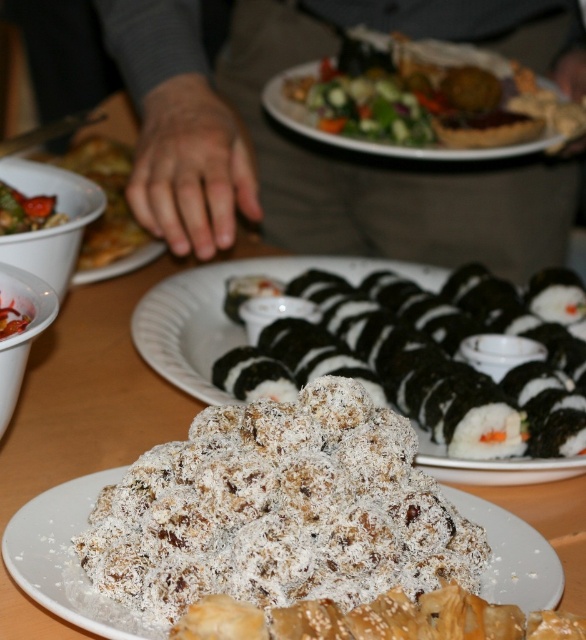
Between point (77, 492) and point (80, 145), which one is positioned in front?

Point (77, 492) is in front.

Who is shorter, white powdered pastry at center or matte white bowl at upper left?

With less height is white powdered pastry at center.

Who is more forward, (46, 604) or (52, 163)?

Point (46, 604) is more forward.

The image size is (586, 640). Find the location of `white powdered pastry at center`. white powdered pastry at center is located at coordinates (x=66, y=557).

The height and width of the screenshot is (640, 586). What do you see at coordinates (408, 376) in the screenshot?
I see `black seaweed sushi at center` at bounding box center [408, 376].

Between black seaweed sushi at center and matte white bowl at upper left, which one appears on the right side from the viewer's perspective?

black seaweed sushi at center

Between point (437, 387) and point (120, 170), which one is positioned in front?

Point (437, 387)

Locate an element on the screen. black seaweed sushi at center is located at coordinates (408, 376).

The image size is (586, 640). In order to click on skinny gray sweater at upper left in this screenshot , I will do `click(326, 148)`.

I want to click on skinny gray sweater at upper left, so click(x=326, y=148).